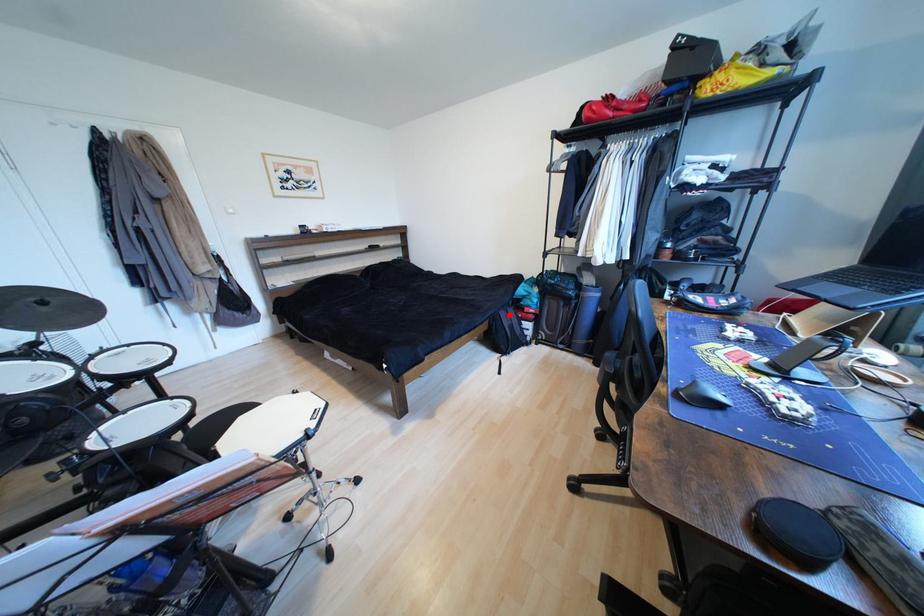
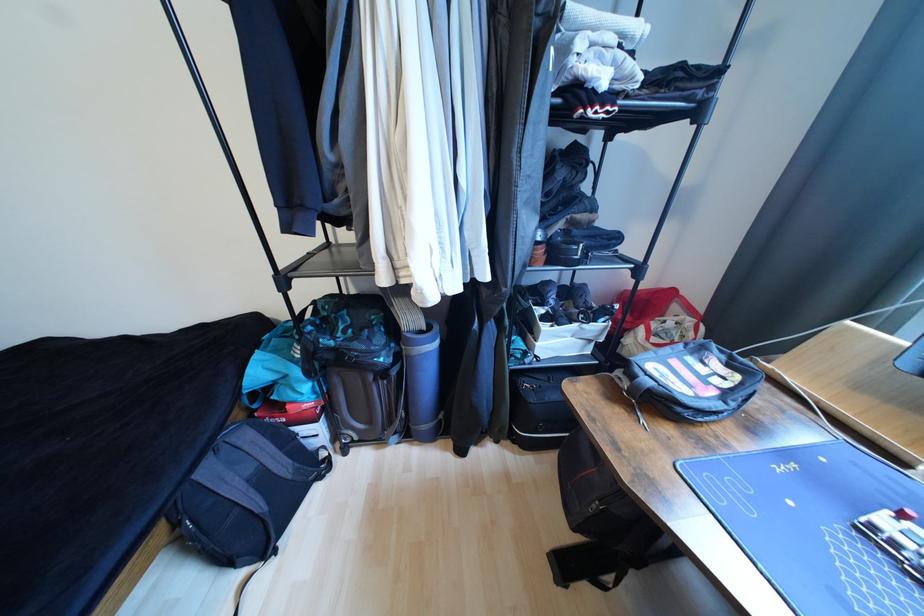
Locate, in the second image, the point that corresponds to the highlighted location in the first image.

(215, 472)